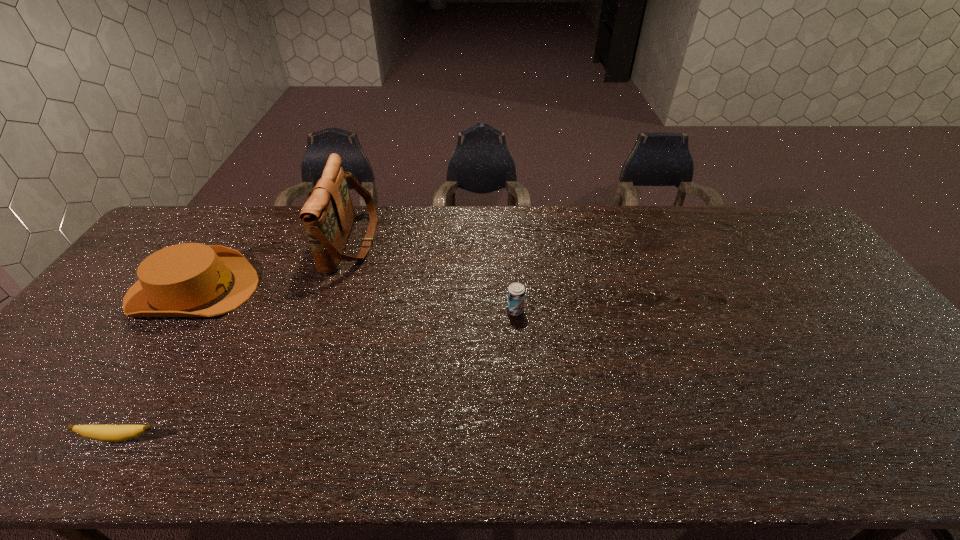
The width and height of the screenshot is (960, 540). Find the location of `object that is at the far edge`. object that is at the far edge is located at coordinates (328, 215).

Find the location of a particular element. This screenshot has width=960, height=540. object situated at the near edge is located at coordinates (108, 433).

Find the location of `object that is positioned at the left edge`. object that is positioned at the left edge is located at coordinates (190, 279).

Where is `vacant space at the far edge of the desktop`? This screenshot has width=960, height=540. vacant space at the far edge of the desktop is located at coordinates (446, 232).

Locate an element on the screen. This screenshot has width=960, height=540. free space at the near edge of the desktop is located at coordinates (823, 441).

Where is `free region at the right edge`? The image size is (960, 540). free region at the right edge is located at coordinates (852, 365).

Identify the location of free region at the far left corner. (178, 237).

Locate an element on the screen. The width and height of the screenshot is (960, 540). empty space between the rightmost object and the cowboy hat is located at coordinates (354, 300).

Locate an element on the screen. free space between the banana and the rightmost object is located at coordinates (318, 374).

Where is `free spot between the rightmost object and the cowboy hat`? This screenshot has width=960, height=540. free spot between the rightmost object and the cowboy hat is located at coordinates (354, 300).